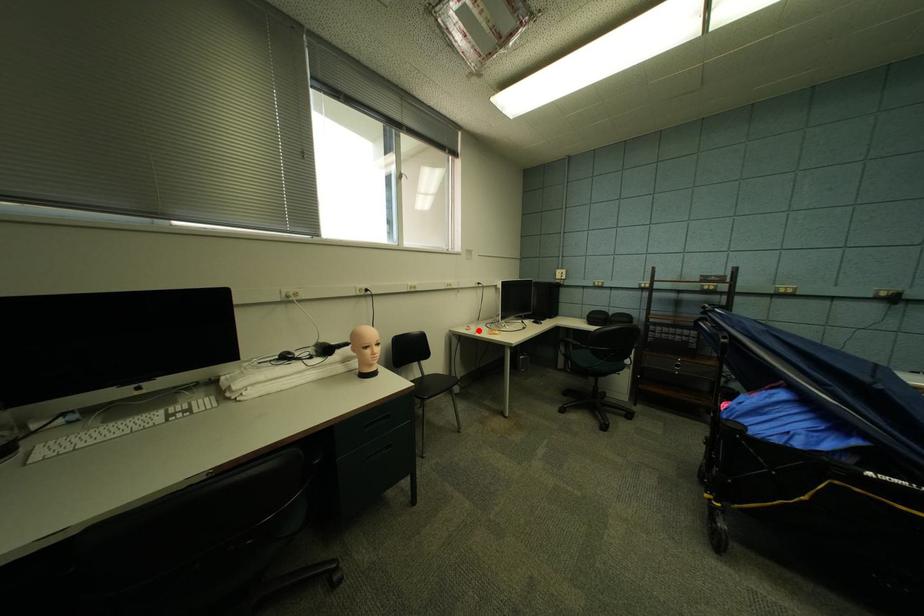
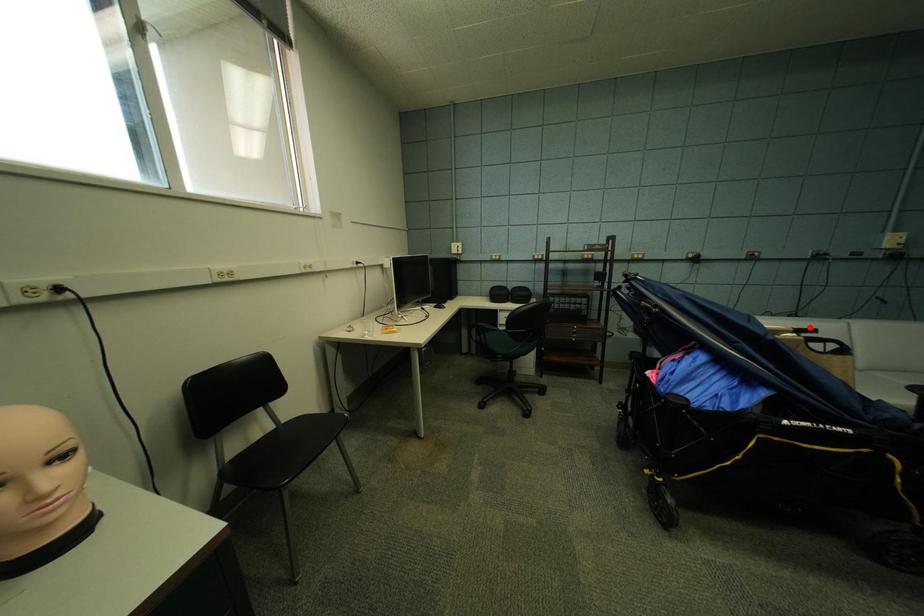
I am providing you with two images of the same scene from different viewpoints. A red point is marked on the first image and another point is marked on the second image. Does the point marked in image1 correspond to the same location as the one in image2?

No